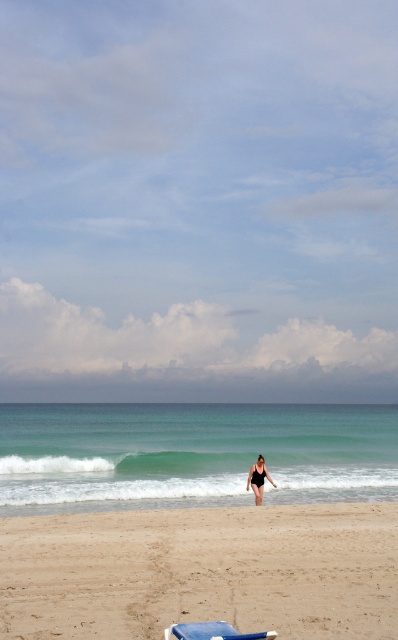
Consider the image. You are standing on the beige sandy beach at center and want to move to the black matte swimsuit at center. Which direction should you walk?

You should walk to the right because the beige sandy beach at center is to the left of the black matte swimsuit at center.

You are standing at the edge of the beach, and you want to reach the blue plastic beach chair at lower center. The distance from you to the chair is 7.20 meters. If you walk at a speed of 1.5 meters per second, how many seconds will it take you to reach the chair?

The distance to the blue plastic beach chair at lower center is 7.20 meters. At a walking speed of 1.5 meters per second, it will take 7.20 divided by 1.5 equals 4.8 seconds to reach the chair.